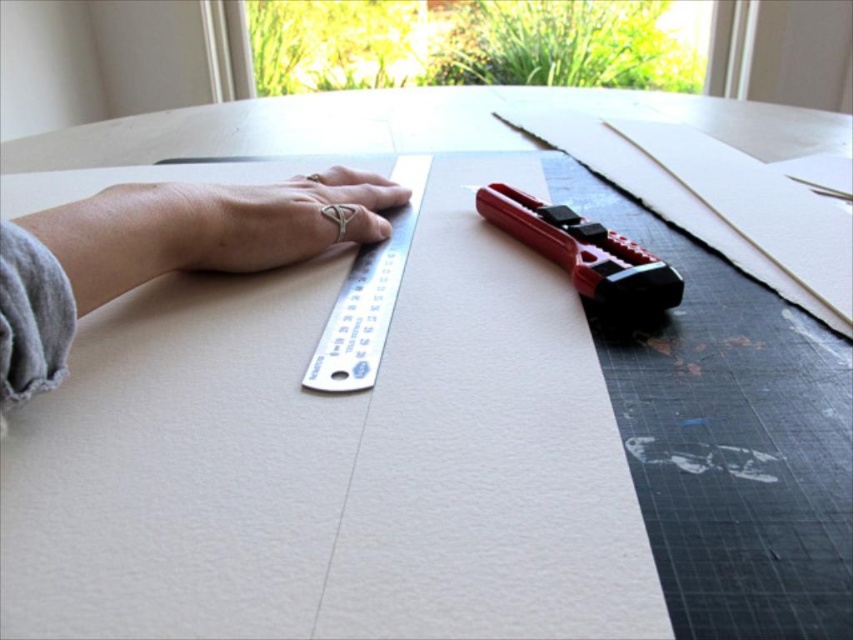
Between point (672, 273) and point (337, 392), which one is positioned in front?

Point (337, 392) is more forward.

Between red plastic stapler at upper right and silver metallic ruler at center, which one appears on the left side from the viewer's perspective?

silver metallic ruler at center is more to the left.

Locate an element on the screen. The image size is (853, 640). red plastic stapler at upper right is located at coordinates (584, 252).

Is gold metallic ring at center positioned in front of red plastic stapler at upper right?

That is True.

Can you confirm if gold metallic ring at center is positioned to the left of red plastic stapler at upper right?

Indeed, gold metallic ring at center is positioned on the left side of red plastic stapler at upper right.

This screenshot has height=640, width=853. In order to click on gold metallic ring at center in this screenshot , I will do `click(277, 220)`.

Where is `gold metallic ring at center`? The height and width of the screenshot is (640, 853). gold metallic ring at center is located at coordinates (277, 220).

Does point (12, 282) lie behind point (200, 266)?

No, (12, 282) is closer to viewer.

Between silver metallic ruler at left and gold metallic ring at center, which one has less height?

gold metallic ring at center

Between point (282, 192) and point (258, 237), which one is positioned behind?

Point (282, 192)

At what (x,y) coordinates should I click in order to perform the action: click on silver metallic ruler at left. Please return your answer as a coordinate pair (x, y). This screenshot has height=640, width=853. Looking at the image, I should click on (161, 250).